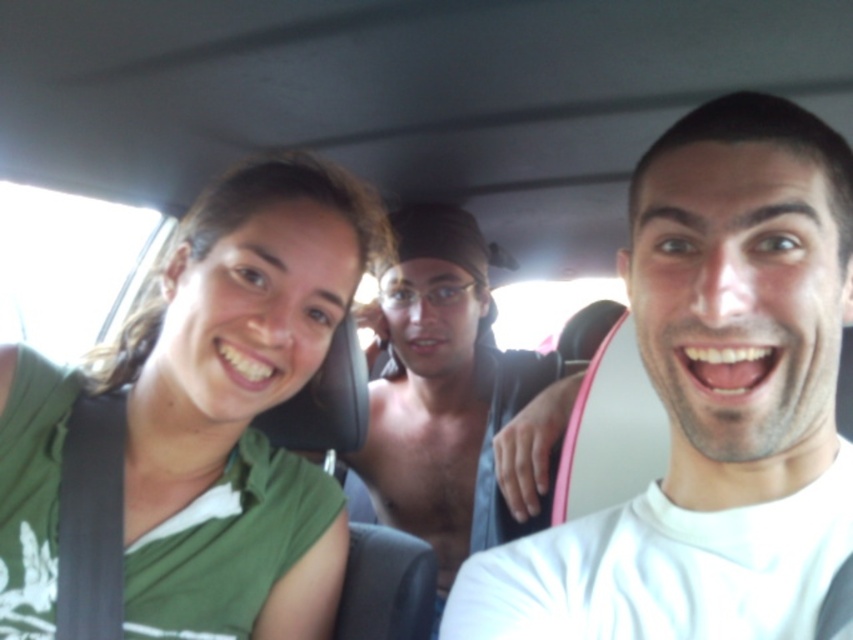
Can you confirm if white matte shirt at center is positioned to the left of green matte shirt at left?

No, white matte shirt at center is not to the left of green matte shirt at left.

How distant is white matte shirt at center from green matte shirt at left?

A distance of 42.92 centimeters exists between white matte shirt at center and green matte shirt at left.

Between point (746, 593) and point (242, 380), which one is positioned in front?

Point (746, 593)

Locate an element on the screen. The height and width of the screenshot is (640, 853). white matte shirt at center is located at coordinates (712, 401).

Does white matte shirt at center appear on the right side of shiny black shirt at center?

Indeed, white matte shirt at center is positioned on the right side of shiny black shirt at center.

Does white matte shirt at center have a lesser width compared to shiny black shirt at center?

Indeed, white matte shirt at center has a lesser width compared to shiny black shirt at center.

Does point (817, 468) come farther from viewer compared to point (503, 353)?

No, it is not.

Locate an element on the screen. The width and height of the screenshot is (853, 640). white matte shirt at center is located at coordinates (712, 401).

Does point (25, 472) come in front of point (532, 484)?

Yes, it is in front of point (532, 484).

Which is in front, point (25, 472) or point (524, 374)?

Point (25, 472) is in front.

Is point (253, 502) positioned before point (421, 454)?

That is True.

At what (x,y) coordinates should I click in order to perform the action: click on green matte shirt at left. Please return your answer as a coordinate pair (x, y). The height and width of the screenshot is (640, 853). Looking at the image, I should click on (213, 406).